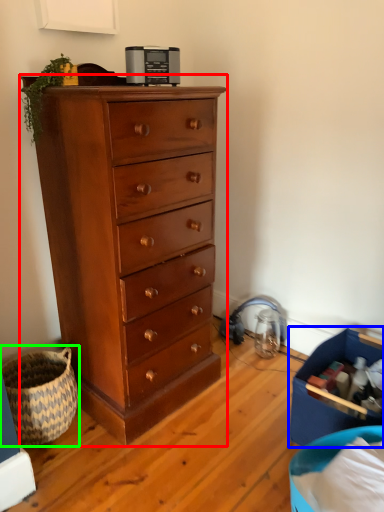
Question: Which object is positioned farthest from chest of drawers (highlighted by a red box)? Select from storage box (highlighted by a blue box) and basket (highlighted by a green box).

Choices:
 (A) storage box
 (B) basket

Answer: (A)